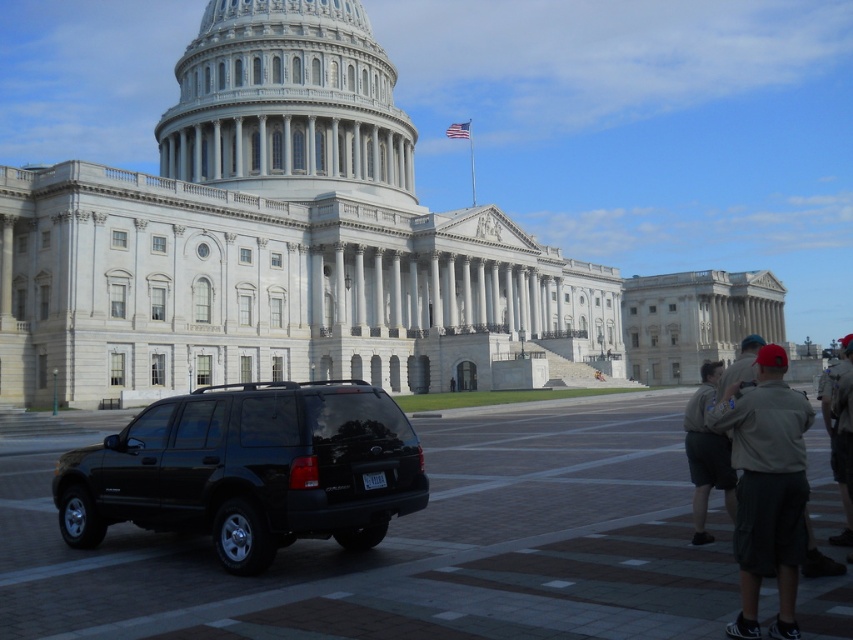
Question: Does khaki uniform at right have a greater width compared to khaki uniform at lower right?

Choices:
 (A) yes
 (B) no

Answer: (B)

Question: Which point is closer to the camera?

Choices:
 (A) (834, 396)
 (B) (120, 476)
 (C) (715, 387)

Answer: (A)

Question: Which of the following is the farthest from the observer?

Choices:
 (A) khaki uniform at right
 (B) black matte suv at center
 (C) khaki uniform at lower right
 (D) khaki shorts at lower right

Answer: (D)

Question: Among these objects, which one is farthest from the camera?

Choices:
 (A) black matte suv at center
 (B) khaki uniform at lower right
 (C) khaki uniform at right
 (D) khaki shorts at lower right

Answer: (D)

Question: Does black matte suv at center have a larger size compared to khaki uniform at lower right?

Choices:
 (A) yes
 (B) no

Answer: (B)

Question: Can you confirm if black matte suv at center is positioned above khaki shorts at lower right?

Choices:
 (A) yes
 (B) no

Answer: (B)